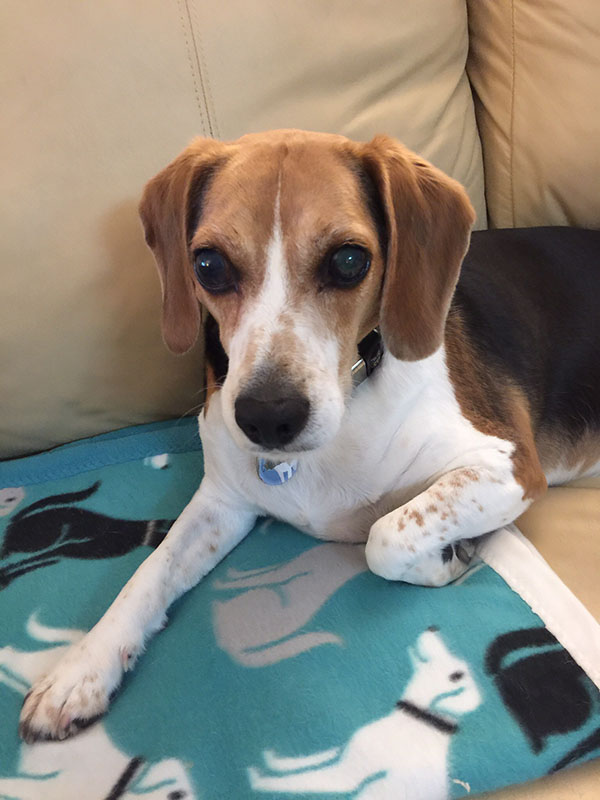
The image size is (600, 800). Identify the location of blanket. (220, 713).